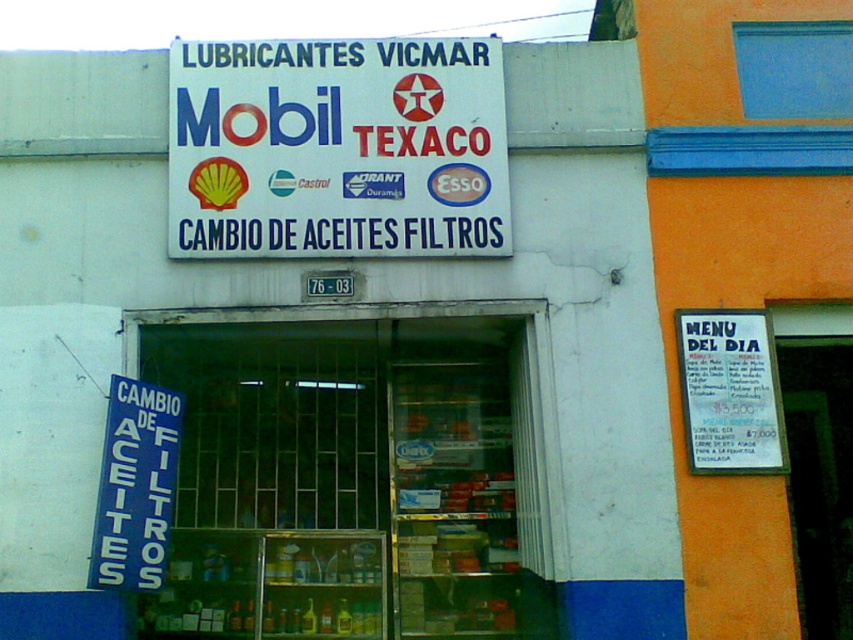
Measure the distance between transparent glass door at center and camera.

4.25 meters

Does transparent glass door at center appear on the right side of white paper menu at right?

In fact, transparent glass door at center is to the left of white paper menu at right.

The image size is (853, 640). Identify the location of transparent glass door at center. coord(354,474).

Is transparent glass door at center above blue plastic sign at lower left?

Incorrect, transparent glass door at center is not positioned above blue plastic sign at lower left.

Identify the location of transparent glass door at center. This screenshot has height=640, width=853. (354, 474).

This screenshot has height=640, width=853. What do you see at coordinates (730, 392) in the screenshot?
I see `white paper menu at right` at bounding box center [730, 392].

Is white paper menu at right bigger than blue plastic sign at lower left?

No.

Who is more forward, (703, 454) or (102, 522)?

Point (102, 522)

What are the coordinates of `white paper menu at right` in the screenshot? It's located at (730, 392).